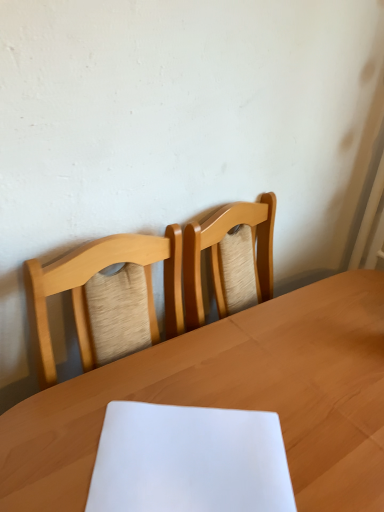
This screenshot has width=384, height=512. I want to click on free location to the right of white paper at center, so click(327, 438).